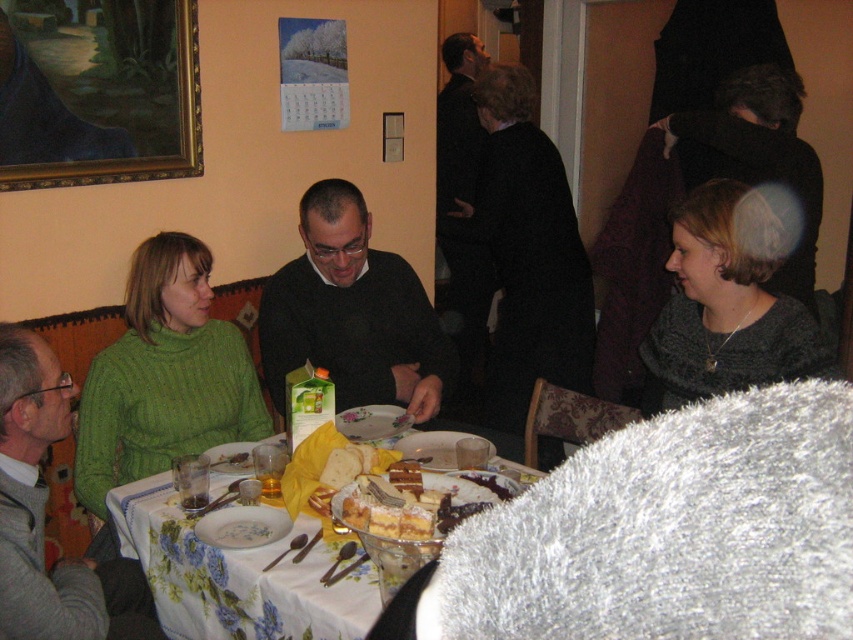
In the scene shown: Who is shorter, green knitted sweater at left or dark green sweater at center?

Standing shorter between the two is dark green sweater at center.

The width and height of the screenshot is (853, 640). In order to click on green knitted sweater at left in this screenshot , I will do `click(164, 376)`.

Does black matte suit at upper center have a greater height compared to porcelain bowl at center?

Yes.

Is point (444, 212) less distant than point (227, 531)?

No, it is behind (227, 531).

The image size is (853, 640). What are the coordinates of `black matte suit at upper center` in the screenshot? It's located at (457, 122).

Can you confirm if dark green sweater at center is taller than black matte suit at upper center?

No.

Measure the distance between dark green sweater at center and camera.

dark green sweater at center is 2.19 meters from camera.

Locate an element on the screen. This screenshot has width=853, height=640. dark green sweater at center is located at coordinates (351, 312).